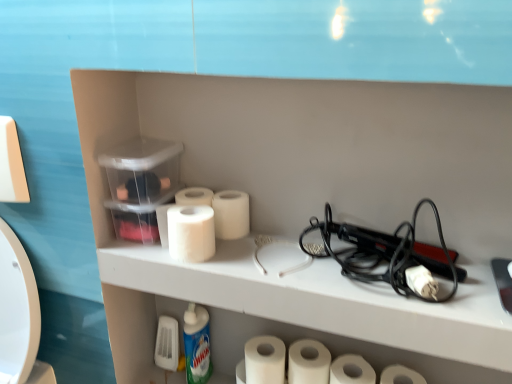
Identify the location of free space in front of white matte toilet paper at center, which ranks as the 5th toilet paper in right-to-left order. (254, 264).